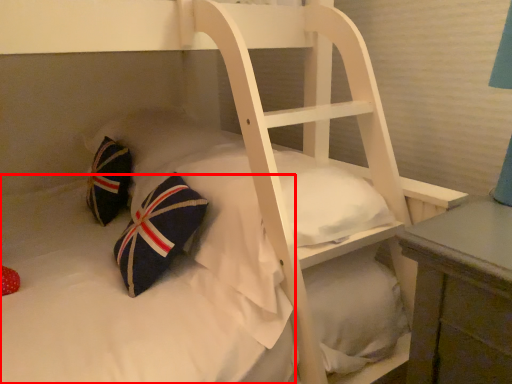
Question: Where is mattress (annotated by the red box) located in relation to pillow in the image?

Choices:
 (A) left
 (B) right

Answer: (B)